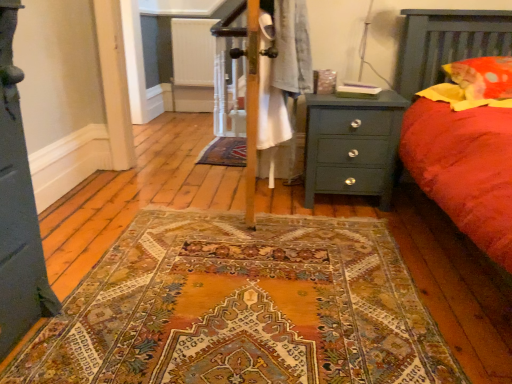
Question: Should I look upward or downward to see green matte nightstand at right?

Choices:
 (A) down
 (B) up

Answer: (B)

Question: Can you confirm if red cotton pillow at upper right is taller than white textured radiator at center?

Choices:
 (A) yes
 (B) no

Answer: (B)

Question: From a real-world perspective, is red cotton pillow at upper right below white textured radiator at center?

Choices:
 (A) yes
 (B) no

Answer: (B)

Question: Does red cotton pillow at upper right turn towards white textured radiator at center?

Choices:
 (A) no
 (B) yes

Answer: (A)

Question: Is red cotton pillow at upper right outside of white textured radiator at center?

Choices:
 (A) yes
 (B) no

Answer: (A)

Question: From a real-world perspective, is red cotton pillow at upper right over white textured radiator at center?

Choices:
 (A) yes
 (B) no

Answer: (A)

Question: Can white textured radiator at center be found inside red cotton pillow at upper right?

Choices:
 (A) yes
 (B) no

Answer: (B)

Question: Considering the relative positions of white textured radiator at center and green matte nightstand at right in the image provided, is white textured radiator at center to the right of green matte nightstand at right from the viewer's perspective?

Choices:
 (A) yes
 (B) no

Answer: (B)

Question: Does white textured radiator at center have a lesser height compared to green matte nightstand at right?

Choices:
 (A) yes
 (B) no

Answer: (B)

Question: Can you confirm if white textured radiator at center is smaller than green matte nightstand at right?

Choices:
 (A) yes
 (B) no

Answer: (A)

Question: Considering the relative sizes of white textured radiator at center and green matte nightstand at right in the image provided, is white textured radiator at center wider than green matte nightstand at right?

Choices:
 (A) no
 (B) yes

Answer: (A)

Question: Is white textured radiator at center not inside green matte nightstand at right?

Choices:
 (A) no
 (B) yes

Answer: (B)

Question: Is white textured radiator at center behind green matte nightstand at right?

Choices:
 (A) yes
 (B) no

Answer: (A)

Question: Can you confirm if red cotton pillow at upper right is positioned to the left of green matte nightstand at right?

Choices:
 (A) yes
 (B) no

Answer: (B)